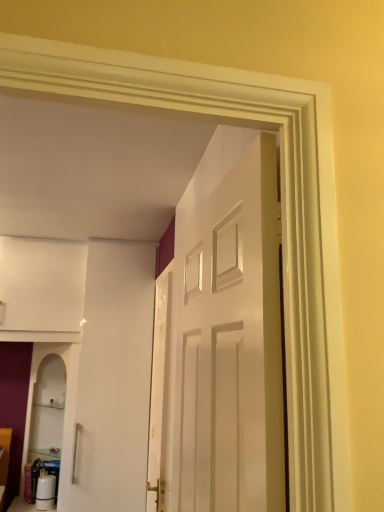
The width and height of the screenshot is (384, 512). What do you see at coordinates (221, 338) in the screenshot?
I see `white glossy door at center` at bounding box center [221, 338].

I want to click on white glossy door at center, so click(x=221, y=338).

Image resolution: width=384 pixels, height=512 pixels. What do you see at coordinates (159, 395) in the screenshot?
I see `white glossy door at center` at bounding box center [159, 395].

What is the approximate height of white glossy door at center?

5.10 feet.

Find the location of a particular element. The image size is (384, 512). white glossy door at center is located at coordinates (159, 395).

The width and height of the screenshot is (384, 512). I want to click on white glossy door at center, so click(221, 338).

Does white glossy door at center appear on the left side of white glossy door at center?

Yes.

Which object is closer to the camera, white glossy door at center or white glossy door at center?

Positioned in front is white glossy door at center.

Between point (159, 509) and point (259, 437), which one is positioned behind?

The point (159, 509) is farther from the camera.

From the image's perspective, relative to white glossy door at center, is white glossy door at center above or below?

white glossy door at center is below white glossy door at center.

From a real-world perspective, is white glossy door at center physically located above or below white glossy door at center?

In terms of real-world spatial position, white glossy door at center is below white glossy door at center.

Between white glossy door at center and white glossy door at center, which one has larger width?

white glossy door at center is wider.

Considering the sizes of objects white glossy door at center and white glossy door at center in the image provided, who is shorter, white glossy door at center or white glossy door at center?

white glossy door at center is shorter.

Between white glossy door at center and white glossy door at center, which one has smaller size?

white glossy door at center.

Would you say white glossy door at center is inside or outside white glossy door at center?

The correct answer is: outside.

Would you consider white glossy door at center to be distant from white glossy door at center?

Actually, white glossy door at center and white glossy door at center are a little close together.

Is white glossy door at center aimed at white glossy door at center?

No, white glossy door at center is not aimed at white glossy door at center.

Find the location of `door located above the white glossy door at center (from a real-world perspective)`. door located above the white glossy door at center (from a real-world perspective) is located at coordinates (221, 338).

Is white glossy door at center to the left of white glossy door at center from the viewer's perspective?

Incorrect, white glossy door at center is not on the left side of white glossy door at center.

Does white glossy door at center lie behind white glossy door at center?

No, the depth of white glossy door at center is less than that of white glossy door at center.

Which is closer, (189, 386) or (151, 437)?

The point (189, 386) is closer.

From the image's perspective, between white glossy door at center and white glossy door at center, which one is located above?

white glossy door at center.

From a real-world perspective, is white glossy door at center on top of white glossy door at center?

Indeed, from a real-world perspective, white glossy door at center stands above white glossy door at center.

Can you confirm if white glossy door at center is wider than white glossy door at center?

Indeed, white glossy door at center has a greater width compared to white glossy door at center.

Which of these two, white glossy door at center or white glossy door at center, stands shorter?

Standing shorter between the two is white glossy door at center.

Consider the image. Is white glossy door at center smaller than white glossy door at center?

No, white glossy door at center is not smaller than white glossy door at center.

Is white glossy door at center inside or outside of white glossy door at center?

white glossy door at center is outside white glossy door at center.

Are white glossy door at center and white glossy door at center making contact?

No.

Is white glossy door at center oriented away from white glossy door at center?

No, white glossy door at center is not facing the opposite direction of white glossy door at center.

Based on the photo, can you tell me how much white glossy door at center and white glossy door at center differ in facing direction?

white glossy door at center and white glossy door at center are facing 1.11 degrees away from each other.

I want to click on screen door below the white glossy door at center (from the image's perspective), so click(x=159, y=395).

The width and height of the screenshot is (384, 512). In order to click on screen door below the white glossy door at center (from the image's perspective) in this screenshot , I will do `click(159, 395)`.

I want to click on door above the white glossy door at center (from a real-world perspective), so 221,338.